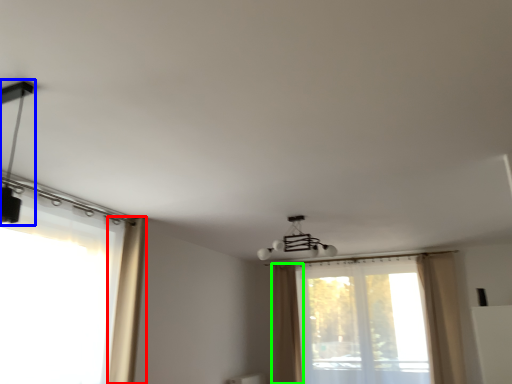
Question: Which is nearer to the curtain (highlighted by a red box)? lamp (highlighted by a blue box) or curtain (highlighted by a green box).

Choices:
 (A) lamp
 (B) curtain

Answer: (A)